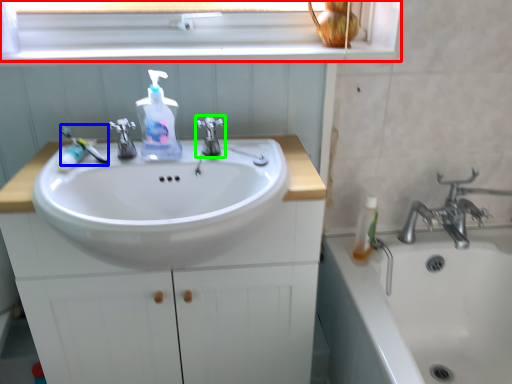
Question: Which is nearer to the window frame (highlighted by a red box)? toothbrush (highlighted by a blue box) or tap (highlighted by a green box).

Choices:
 (A) toothbrush
 (B) tap

Answer: (B)